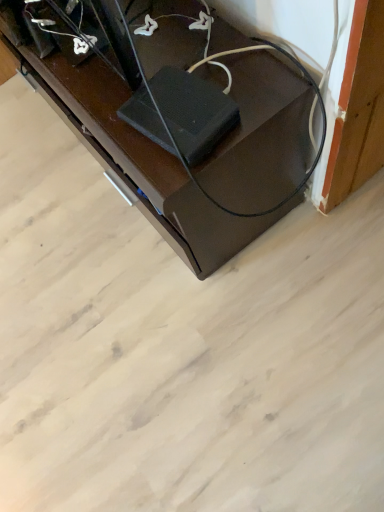
Where is `free space behind black rubber speaker at center`? This screenshot has width=384, height=512. free space behind black rubber speaker at center is located at coordinates (143, 68).